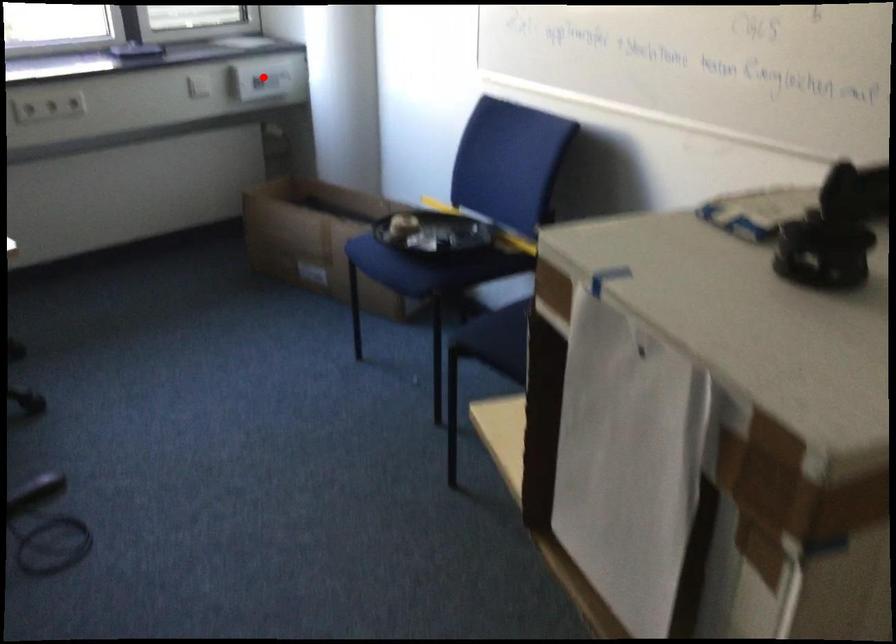
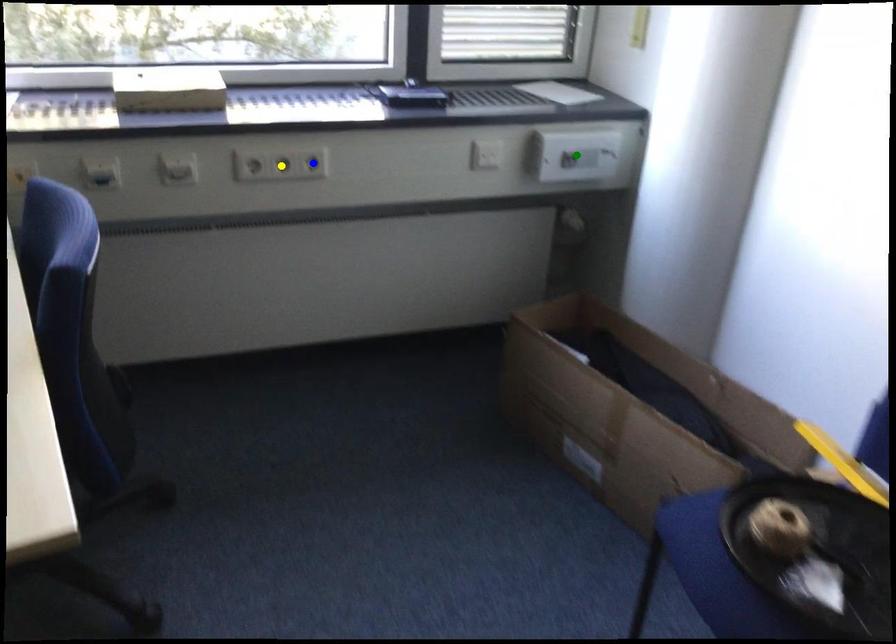
Question: I am providing you with two images of the same scene from different viewpoints. A red point is marked on the first image. You are given multiple points on the second image. Which point in image 2 is actually the same real-world point as the red point in image 1?

Choices:
 (A) green point
 (B) blue point
 (C) yellow point

Answer: (A)